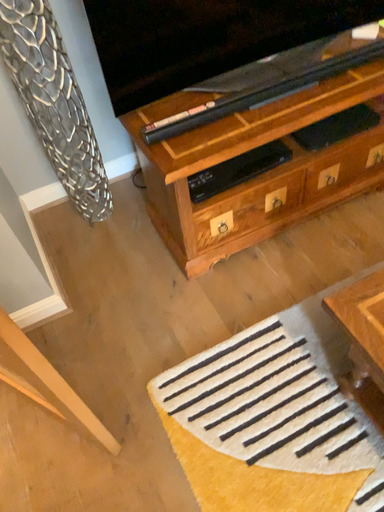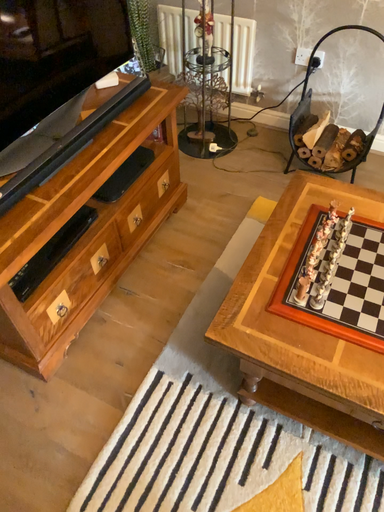
Question: Which way did the camera rotate in the video?

Choices:
 (A) rotated left
 (B) rotated right

Answer: (B)